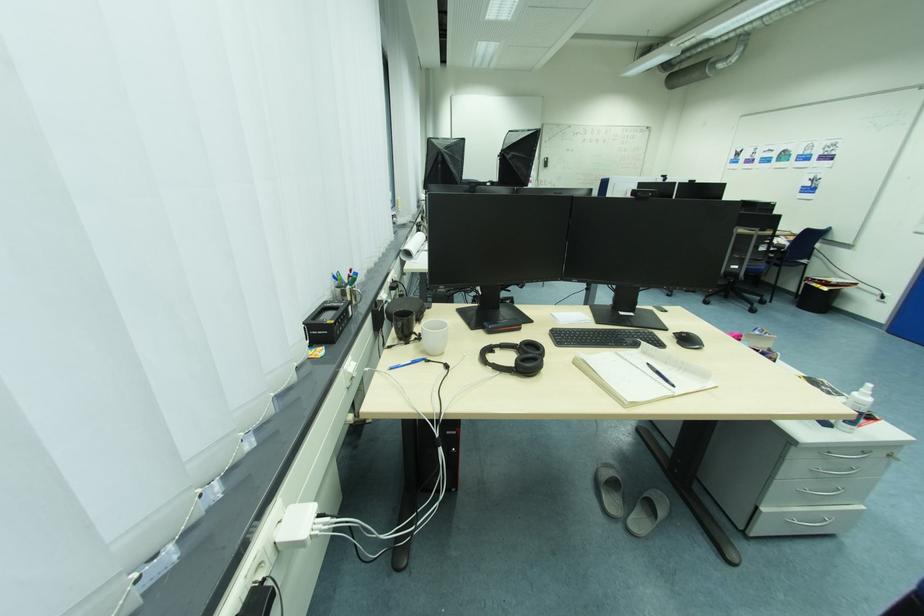
Find the location of a particular element. Image resolution: width=924 pixels, height=616 pixels. blue pen is located at coordinates (407, 363).